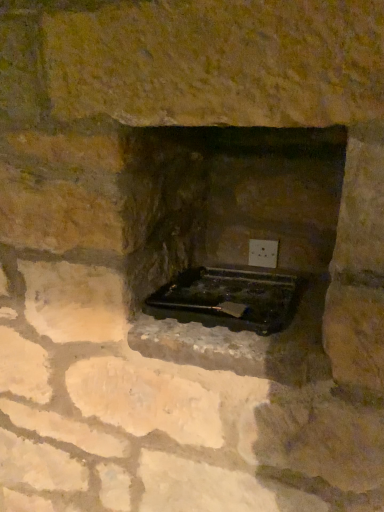
Locate an element on the screen. This screenshot has height=512, width=384. free space in front of white plastic electric outlet at center is located at coordinates (278, 272).